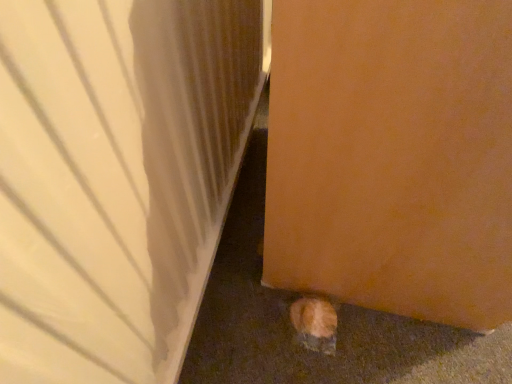
Question: Is matte wood door at lower right, positioned as the first door in left-to-right order, far from orange fur cat at lower right?

Choices:
 (A) no
 (B) yes

Answer: (A)

Question: Could you tell me if matte wood door at lower right, acting as the 2th door starting from the right, is facing orange fur cat at lower right?

Choices:
 (A) yes
 (B) no

Answer: (A)

Question: Is matte wood door at lower right, acting as the 2th door starting from the right, positioned in front of orange fur cat at lower right?

Choices:
 (A) no
 (B) yes

Answer: (B)

Question: Considering the relative positions of matte wood door at lower right, positioned as the first door in left-to-right order, and orange fur cat at lower right in the image provided, is matte wood door at lower right, positioned as the first door in left-to-right order, to the right of orange fur cat at lower right from the viewer's perspective?

Choices:
 (A) no
 (B) yes

Answer: (A)

Question: Can you confirm if matte wood door at lower right, acting as the 2th door starting from the right, is wider than orange fur cat at lower right?

Choices:
 (A) yes
 (B) no

Answer: (A)

Question: Based on their positions, is orange matte door at lower right, which appears as the 1th door when viewed from the right, located to the left or right of orange fur cat at lower right?

Choices:
 (A) right
 (B) left

Answer: (A)

Question: Is orange matte door at lower right, the 2th door from the left, bigger or smaller than orange fur cat at lower right?

Choices:
 (A) small
 (B) big

Answer: (B)

Question: Choose the correct answer: Is orange matte door at lower right, the 2th door from the left, inside orange fur cat at lower right or outside it?

Choices:
 (A) outside
 (B) inside

Answer: (A)

Question: From the image's perspective, relative to orange fur cat at lower right, is orange matte door at lower right, the 2th door from the left, above or below?

Choices:
 (A) below
 (B) above

Answer: (B)

Question: From their relative heights in the image, would you say orange fur cat at lower right is taller or shorter than orange matte door at lower right, which appears as the 1th door when viewed from the right?

Choices:
 (A) tall
 (B) short

Answer: (B)

Question: Is orange fur cat at lower right in front of or behind orange matte door at lower right, the 2th door from the left, in the image?

Choices:
 (A) behind
 (B) front

Answer: (A)

Question: Based on their sizes in the image, would you say orange fur cat at lower right is bigger or smaller than orange matte door at lower right, which appears as the 1th door when viewed from the right?

Choices:
 (A) small
 (B) big

Answer: (A)

Question: From a real-world perspective, is orange fur cat at lower right physically located above or below orange matte door at lower right, which appears as the 1th door when viewed from the right?

Choices:
 (A) below
 (B) above

Answer: (A)

Question: From their relative heights in the image, would you say orange fur cat at lower right is taller or shorter than matte wood door at lower right, acting as the 2th door starting from the right?

Choices:
 (A) short
 (B) tall

Answer: (A)

Question: In terms of width, does orange fur cat at lower right look wider or thinner when compared to matte wood door at lower right, acting as the 2th door starting from the right?

Choices:
 (A) thin
 (B) wide

Answer: (A)